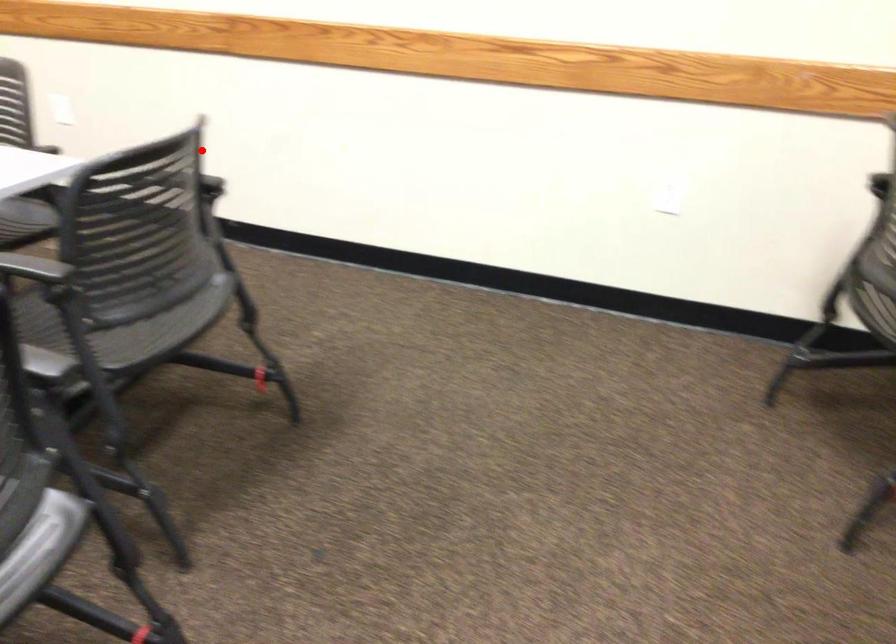
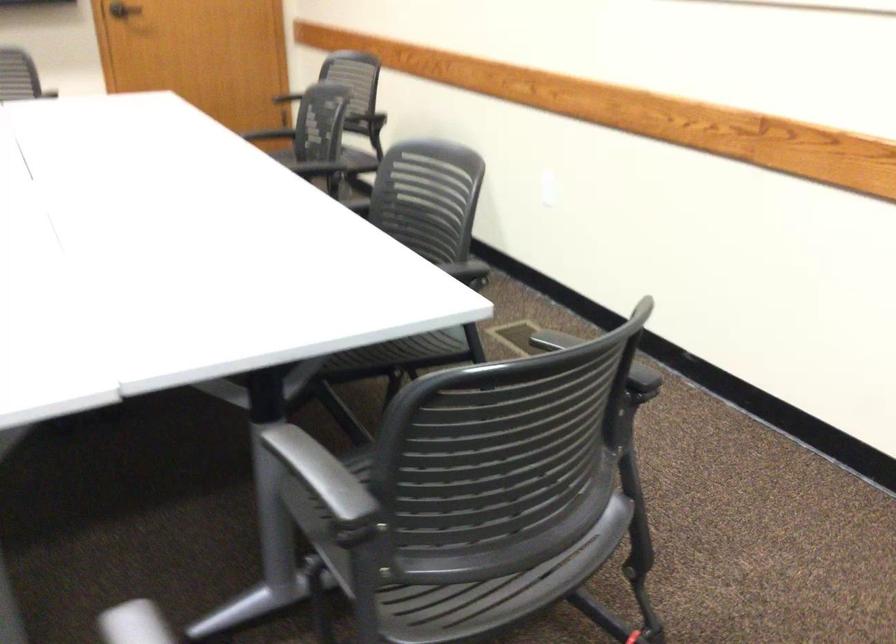
The point at the highlighted location is marked in the first image. Where is the corresponding point in the second image?

(598, 359)